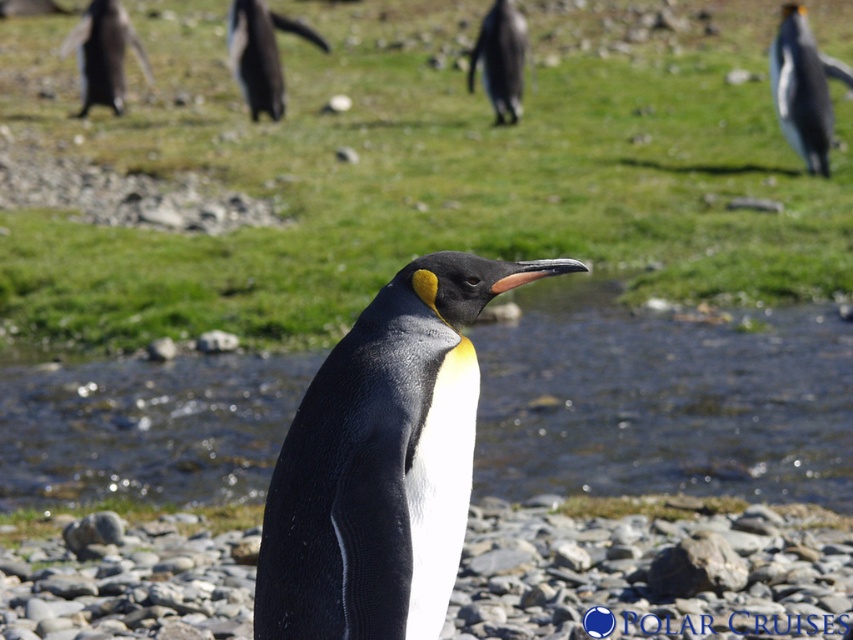
Is black glossy penguin at upper right closer to camera compared to black glossy penguin at center?

Yes, it is.

Which is in front, point (820, 125) or point (509, 72)?

Point (820, 125) is in front.

Is point (790, 77) closer to camera compared to point (517, 49)?

Yes.

The height and width of the screenshot is (640, 853). I want to click on black glossy penguin at upper right, so click(x=804, y=88).

Can you confirm if green grass at center is positioned below clear water at center?

No.

Which is behind, point (778, 147) or point (544, 385)?

Point (778, 147)

Is point (265, 280) in front of point (479, 493)?

No.

This screenshot has height=640, width=853. I want to click on green grass at center, so click(402, 168).

Does point (608, 321) come farther from viewer compared to point (514, 102)?

That is False.

Describe the element at coordinates (666, 404) in the screenshot. The height and width of the screenshot is (640, 853). I see `clear water at center` at that location.

You are a GUI agent. You are given a task and a screenshot of the screen. Output one action in this format:
    pyautogui.click(x=<x>, y=<y>)
    Task: Click on the clear water at center
    Image resolution: width=853 pixels, height=640 pixels.
    Given the screenshot: What is the action you would take?
    pyautogui.click(x=666, y=404)